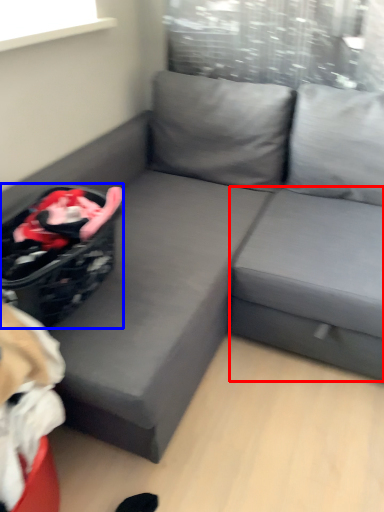
Question: Among these objects, which one is nearest to the camera, table (highlighted by a red box) or laundry basket (highlighted by a blue box)?

Choices:
 (A) table
 (B) laundry basket

Answer: (B)